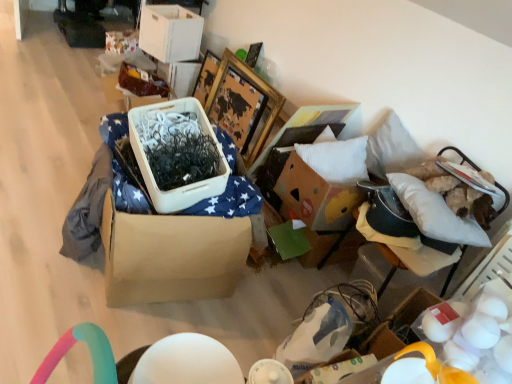
The height and width of the screenshot is (384, 512). Find the location of `free space to the left of brown cardboard box at center`. free space to the left of brown cardboard box at center is located at coordinates (35, 228).